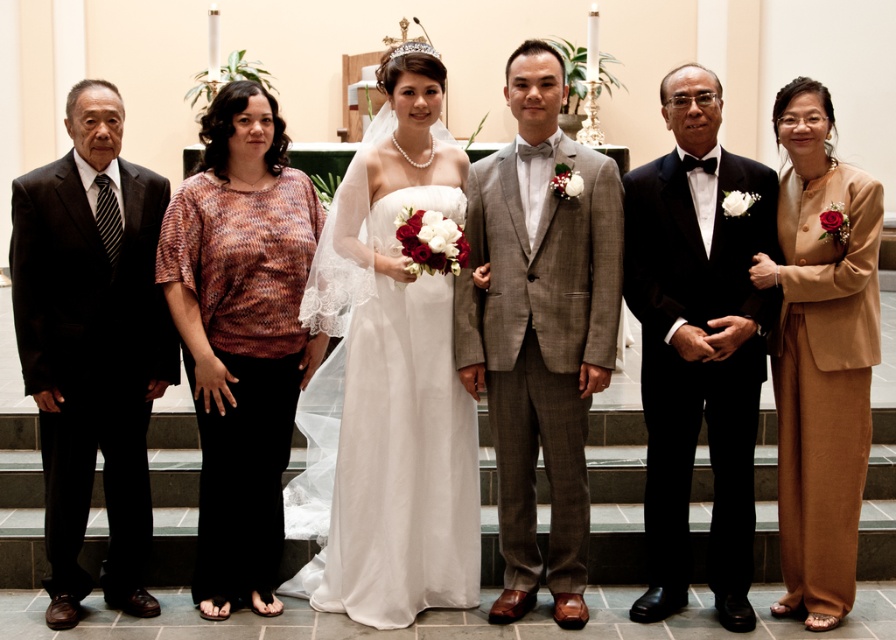
Question: Which object is the farthest from the gray textured suit at center?

Choices:
 (A) black suit at left
 (B) tan fabric suit at right
 (C) white satin dress at center

Answer: (A)

Question: Does white satin dress at center appear over gray textured suit at center?

Choices:
 (A) no
 (B) yes

Answer: (A)

Question: Which object appears farthest from the camera in this image?

Choices:
 (A) black suit at left
 (B) tan fabric suit at right
 (C) white satin dress at center
 (D) gray textured suit at center

Answer: (D)

Question: Considering the relative positions of printed cotton blouse at center and tan fabric suit at right in the image provided, where is printed cotton blouse at center located with respect to tan fabric suit at right?

Choices:
 (A) above
 (B) below

Answer: (A)

Question: Does black satin tuxedo at center have a larger size compared to tan fabric suit at right?

Choices:
 (A) no
 (B) yes

Answer: (A)

Question: Among these objects, which one is farthest from the camera?

Choices:
 (A) black satin tuxedo at center
 (B) black suit at left
 (C) gray textured suit at center
 (D) printed cotton blouse at center

Answer: (D)